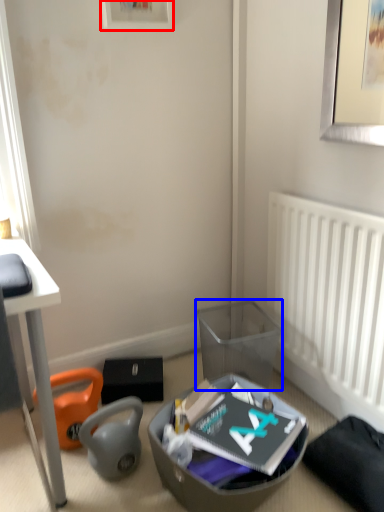
Question: Which object is closer to the camera taking this photo, picture frame (highlighted by a red box) or trash bin/can (highlighted by a blue box)?

Choices:
 (A) picture frame
 (B) trash bin/can

Answer: (A)